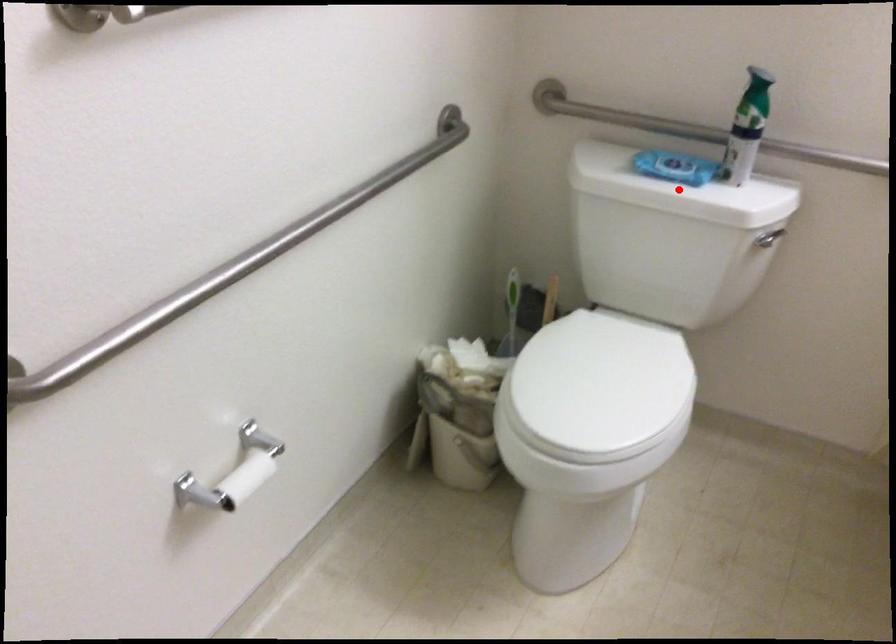
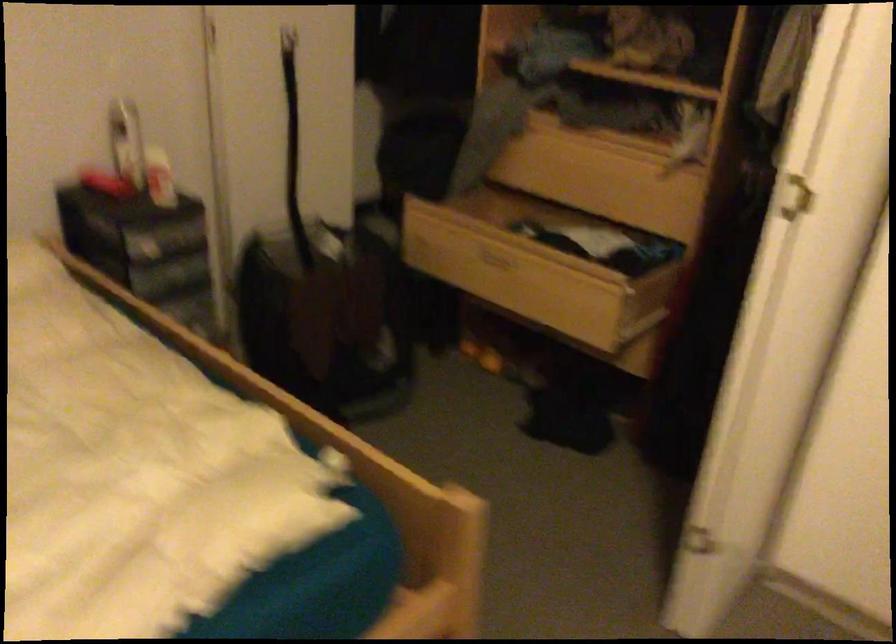
Question: I am providing you with two images of the same scene from different viewpoints. A red point is marked on the first image. At the location where the point appears in image 1, is it still visible in image 2?

Choices:
 (A) Yes
 (B) No

Answer: (B)